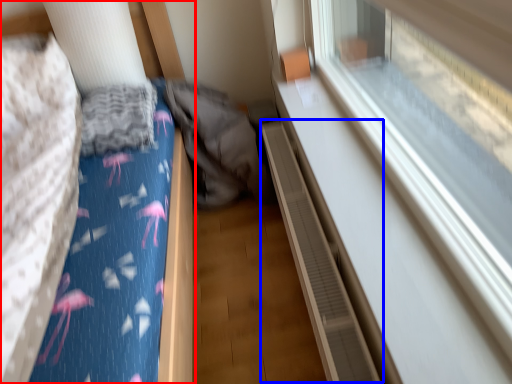
Question: Among these objects, which one is nearest to the camera, furniture (highlighted by a red box) or balustrade (highlighted by a blue box)?

Choices:
 (A) furniture
 (B) balustrade

Answer: (A)